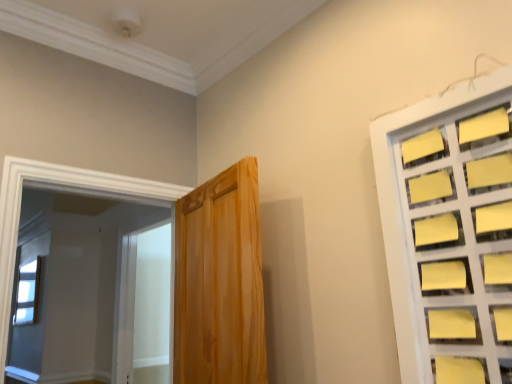
Question: From the image's perspective, is white frosted glass screen door at left under clear glass window at upper left, which is counted as the second window, starting from the right?

Choices:
 (A) yes
 (B) no

Answer: (B)

Question: Can you confirm if white frosted glass screen door at left is bigger than clear glass window at upper left, the 2th window when ordered from top to bottom?

Choices:
 (A) yes
 (B) no

Answer: (A)

Question: Is white frosted glass screen door at left facing away from clear glass window at upper left, which appears as the 1th window when ordered from the bottom?

Choices:
 (A) no
 (B) yes

Answer: (A)

Question: Is white frosted glass screen door at left positioned before clear glass window at upper left, which appears as the 1th window when ordered from the bottom?

Choices:
 (A) yes
 (B) no

Answer: (A)

Question: Is white frosted glass screen door at left taller than clear glass window at upper left, which ranks as the 2th window in front-to-back order?

Choices:
 (A) yes
 (B) no

Answer: (A)

Question: Would you consider white frosted glass screen door at left to be distant from clear glass window at upper left, the first window when ordered from left to right?

Choices:
 (A) no
 (B) yes

Answer: (A)

Question: Is clear glass window at upper left, which is counted as the 1th window, starting from the back, at the left side of yellow paper at right, acting as the 2th window starting from the left?

Choices:
 (A) no
 (B) yes

Answer: (B)

Question: Is clear glass window at upper left, which ranks as the 2th window in front-to-back order, thinner than yellow paper at right, acting as the 2th window starting from the left?

Choices:
 (A) yes
 (B) no

Answer: (A)

Question: Is clear glass window at upper left, which is counted as the 1th window, starting from the back, at the right side of yellow paper at right, the 1th window positioned from the front?

Choices:
 (A) no
 (B) yes

Answer: (A)

Question: Does clear glass window at upper left, which ranks as the 2th window in front-to-back order, have a larger size compared to yellow paper at right, which is the second window from back to front?

Choices:
 (A) yes
 (B) no

Answer: (B)

Question: Would you say clear glass window at upper left, which ranks as the 2th window in front-to-back order, is outside yellow paper at right, the first window from the right?

Choices:
 (A) yes
 (B) no

Answer: (A)

Question: Are clear glass window at upper left, which ranks as the 2th window in front-to-back order, and yellow paper at right, the 2th window in the bottom-to-top sequence, far apart?

Choices:
 (A) no
 (B) yes

Answer: (B)

Question: Are clear glass window at upper left, which appears as the 1th window when ordered from the bottom, and wooden door at center beside each other?

Choices:
 (A) no
 (B) yes

Answer: (A)